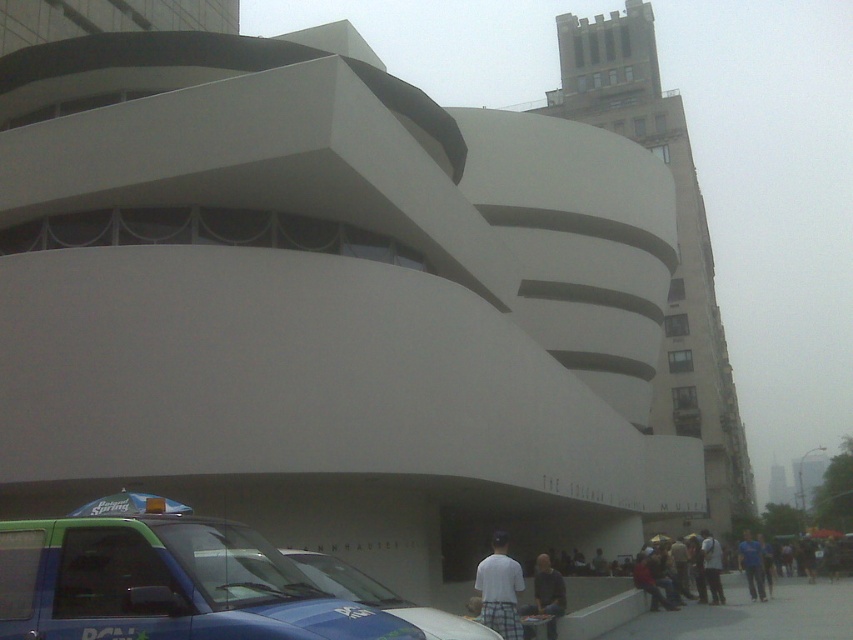
Is blue glossy car at lower left thinner than white plaid shorts at lower center?

In fact, blue glossy car at lower left might be wider than white plaid shorts at lower center.

Which is above, blue glossy car at lower left or white plaid shorts at lower center?

blue glossy car at lower left

Is point (401, 612) closer to viewer compared to point (477, 584)?

Yes, it is in front of point (477, 584).

Image resolution: width=853 pixels, height=640 pixels. I want to click on blue glossy car at lower left, so click(x=383, y=596).

Is point (662, 520) farther from viewer compared to point (366, 588)?

Yes, it is behind point (366, 588).

Between point (749, 513) and point (363, 598), which one is positioned in front?

Point (363, 598)

This screenshot has height=640, width=853. Find the location of `white smooth building at center`. white smooth building at center is located at coordinates (677, 241).

Is the position of blue glossy van at lower left less distant than that of white cotton shirt at center?

Yes, it is in front of white cotton shirt at center.

Is blue glossy van at lower left below white cotton shirt at center?

No.

Which is behind, point (323, 637) or point (724, 602)?

The point (724, 602) is more distant.

The width and height of the screenshot is (853, 640). In order to click on blue glossy van at lower left in this screenshot , I will do `click(166, 582)`.